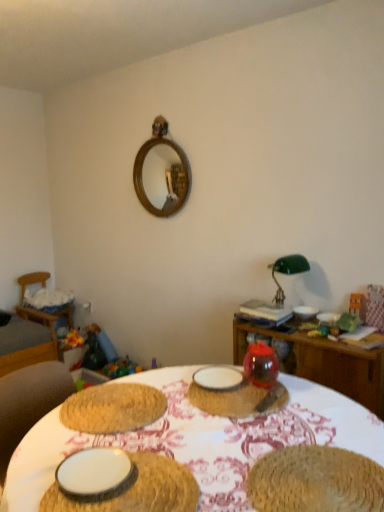
Question: Is wooden table at center, which is counted as the 2th table, starting from the front, inside white matte plate at lower left, marked as the 4th tableware in a back-to-front arrangement?

Choices:
 (A) no
 (B) yes

Answer: (A)

Question: From the image's perspective, is white matte plate at lower left, placed as the fourth tableware when sorted from right to left, on top of wooden table at center, which is counted as the 2th table, starting from the front?

Choices:
 (A) yes
 (B) no

Answer: (A)

Question: Considering the relative positions of white matte plate at lower left, marked as the 4th tableware in a back-to-front arrangement, and wooden table at center, the first table when ordered from back to front, in the image provided, is white matte plate at lower left, marked as the 4th tableware in a back-to-front arrangement, in front of wooden table at center, the first table when ordered from back to front,?

Choices:
 (A) yes
 (B) no

Answer: (A)

Question: Is white matte plate at lower left, placed as the fourth tableware when sorted from right to left, to the right of wooden table at center, which is counted as the 2th table, starting from the front, from the viewer's perspective?

Choices:
 (A) no
 (B) yes

Answer: (A)

Question: Is white matte plate at lower left, placed as the fourth tableware when sorted from right to left, located outside wooden table at center, which is counted as the 2th table, starting from the front?

Choices:
 (A) yes
 (B) no

Answer: (A)

Question: Is white matte plate at lower left, marked as the 4th tableware in a back-to-front arrangement, wider or thinner than translucent glass vase at center, which ranks as the third tableware in left-to-right order?

Choices:
 (A) wide
 (B) thin

Answer: (B)

Question: Based on their positions, is white matte plate at lower left, the 1th tableware in the front-to-back sequence, located to the left or right of translucent glass vase at center, which appears as the second tableware when viewed from the front?

Choices:
 (A) left
 (B) right

Answer: (A)

Question: Is white matte plate at lower left, marked as the 4th tableware in a back-to-front arrangement, inside the boundaries of translucent glass vase at center, which appears as the second tableware when viewed from the front, or outside?

Choices:
 (A) outside
 (B) inside

Answer: (A)

Question: Relative to translucent glass vase at center, which appears as the second tableware when viewed from the front, is white matte plate at lower left, marked as the 4th tableware in a back-to-front arrangement, in front or behind?

Choices:
 (A) front
 (B) behind

Answer: (A)

Question: Is wooden mirror at upper center to the left or to the right of wooden swivel chair at left in the image?

Choices:
 (A) right
 (B) left

Answer: (A)

Question: Looking at their shapes, would you say wooden mirror at upper center is wider or thinner than wooden swivel chair at left?

Choices:
 (A) wide
 (B) thin

Answer: (B)

Question: Is wooden mirror at upper center taller or shorter than wooden swivel chair at left?

Choices:
 (A) tall
 (B) short

Answer: (A)

Question: Is wooden mirror at upper center bigger or smaller than wooden swivel chair at left?

Choices:
 (A) small
 (B) big

Answer: (A)

Question: Based on their sizes in the image, would you say white matte plate at lower left, which appears as the fourth tableware when viewed from the top, is bigger or smaller than wooden swivel chair at left?

Choices:
 (A) small
 (B) big

Answer: (A)

Question: From a real-world perspective, is white matte plate at lower left, placed as the fourth tableware when sorted from right to left, physically located above or below wooden swivel chair at left?

Choices:
 (A) above
 (B) below

Answer: (A)